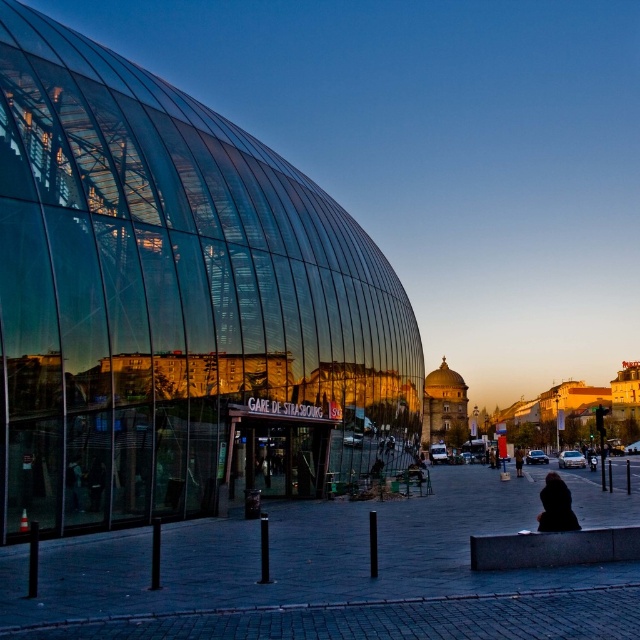
You are an interior designer assessing the layout of the station. You need to place a large sculpture that requires 10 square feet of space. Given the black matte coat at lower right and dark brown leather jacket at center, which item can accommodate the sculpture?

The dark brown leather jacket at center occupies more space than the black matte coat at lower right, so the sculpture can be placed near the dark brown leather jacket at center.

You are standing at the entrance of GARE DE STRASBOURG and want to locate the dark brown leather jacket at center. According to the scene, which direction should you turn to face the transparent glass building at left?

To face the transparent glass building at left, you should turn to your left because it is positioned to the left of the dark brown leather jacket at center.

You are standing at the center of the image. Which direction should you move to reach the granite bench at lower right?

The granite bench at lower right is located at coordinates approximately 0.858 on the x and y axis, so you should move towards the lower right direction to reach it.